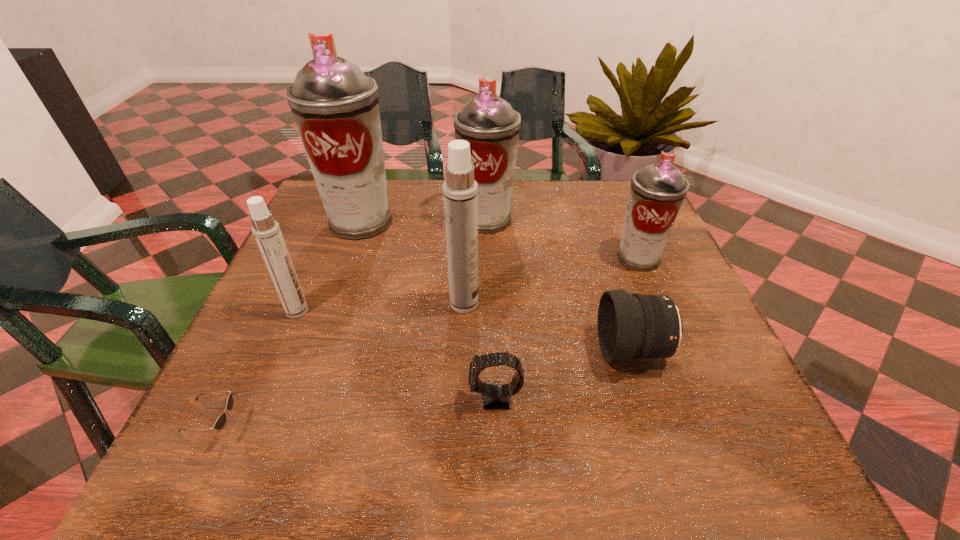
Identify which gray aerosol can is the second nearest to the second gray aerosol can from right to left. Please provide its 2D coordinates. Your answer should be formatted as a tuple, i.e. [(x, y)], where the tuple contains the x and y coordinates of a point satisfying the conditions above.

[(657, 191)]